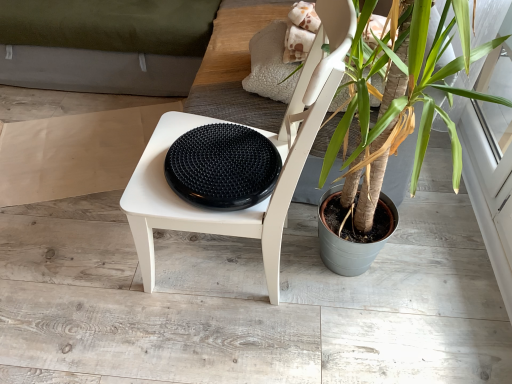
The height and width of the screenshot is (384, 512). Identify the location of free space that is to the left of white matte chair at center. pos(89,277).